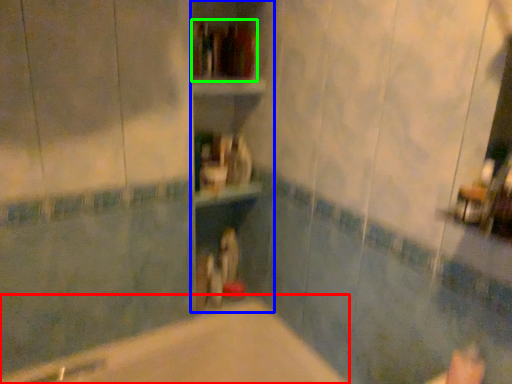
Question: Which object is positioned closest to bathtub (highlighted by a red box)? Select from bookshelf (highlighted by a blue box) and book (highlighted by a green box).

Choices:
 (A) bookshelf
 (B) book

Answer: (A)